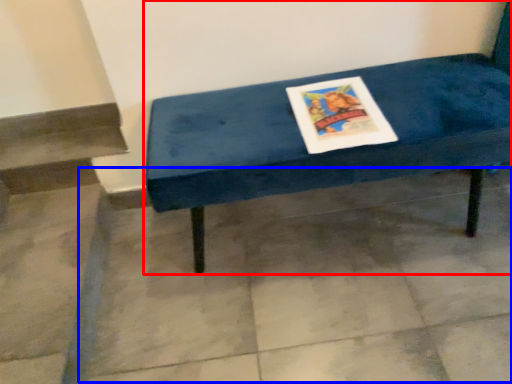
Question: Which object appears farthest to the camera in this image, furniture (highlighted by a red box) or concrete (highlighted by a blue box)?

Choices:
 (A) furniture
 (B) concrete

Answer: (B)